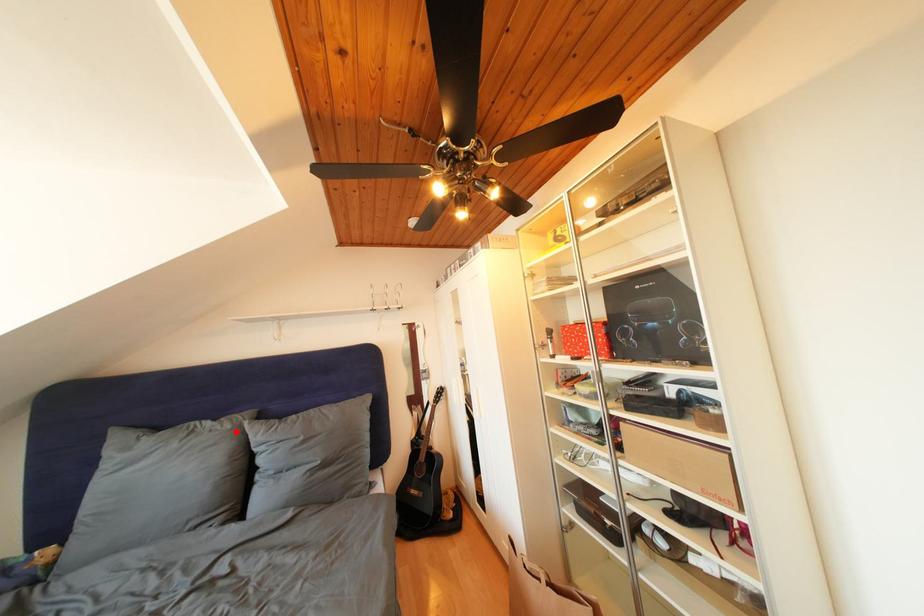
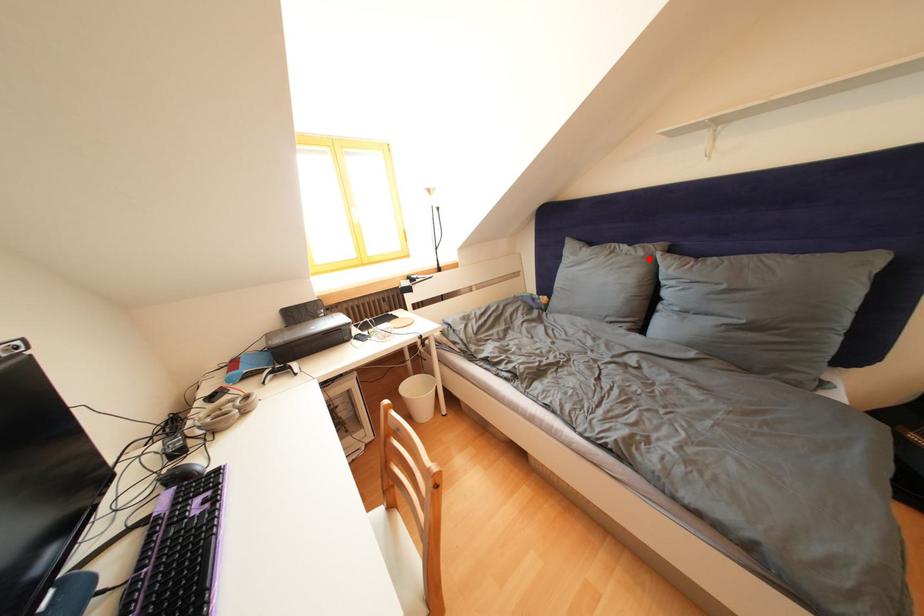
I am providing you with two images of the same scene from different viewpoints. A red point is marked on the first image and another point is marked on the second image. Do the highlighted points in image1 and image2 indicate the same real-world spot?

Yes